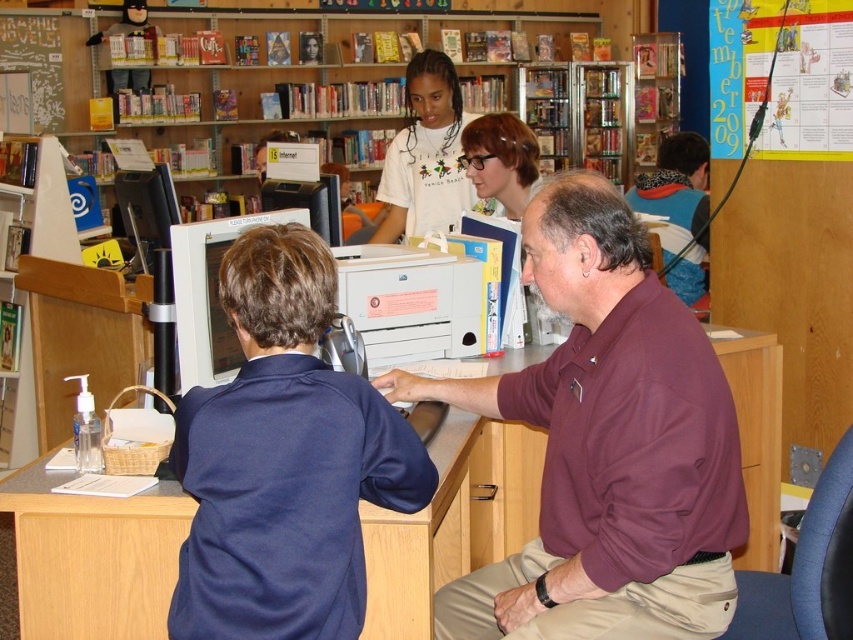
Is blue fabric shirt at center wider than wooden bookshelf at upper center?

Indeed, blue fabric shirt at center has a greater width compared to wooden bookshelf at upper center.

Between blue fabric shirt at center and wooden bookshelf at upper center, which one has less height?

Standing shorter between the two is wooden bookshelf at upper center.

Identify the location of blue fabric shirt at center. This screenshot has width=853, height=640. (283, 460).

The width and height of the screenshot is (853, 640). I want to click on blue fabric shirt at center, so click(x=283, y=460).

Between white cotton shirt at center and wooden bookshelf at upper center, which one is positioned lower?

white cotton shirt at center

Does white cotton shirt at center come behind wooden bookshelf at upper center?

No, it is not.

At what (x,y) coordinates should I click in order to perform the action: click on white cotton shirt at center. Please return your answer as a coordinate pair (x, y). The height and width of the screenshot is (640, 853). Looking at the image, I should click on (425, 156).

Where is `white cotton shirt at center`? This screenshot has height=640, width=853. white cotton shirt at center is located at coordinates (425, 156).

Can you confirm if white cotton shirt at center is positioned below matte white monitor at center?

Incorrect, white cotton shirt at center is not positioned below matte white monitor at center.

Can you confirm if white cotton shirt at center is shorter than matte white monitor at center?

Incorrect, white cotton shirt at center's height does not fall short of matte white monitor at center's.

Who is more forward, [427,164] or [190,298]?

Point [190,298] is in front.

You are a GUI agent. You are given a task and a screenshot of the screen. Output one action in this format:
    pyautogui.click(x=<x>, y=<y>)
    Task: Click on the white cotton shirt at center
    
    Given the screenshot: What is the action you would take?
    pyautogui.click(x=425, y=156)